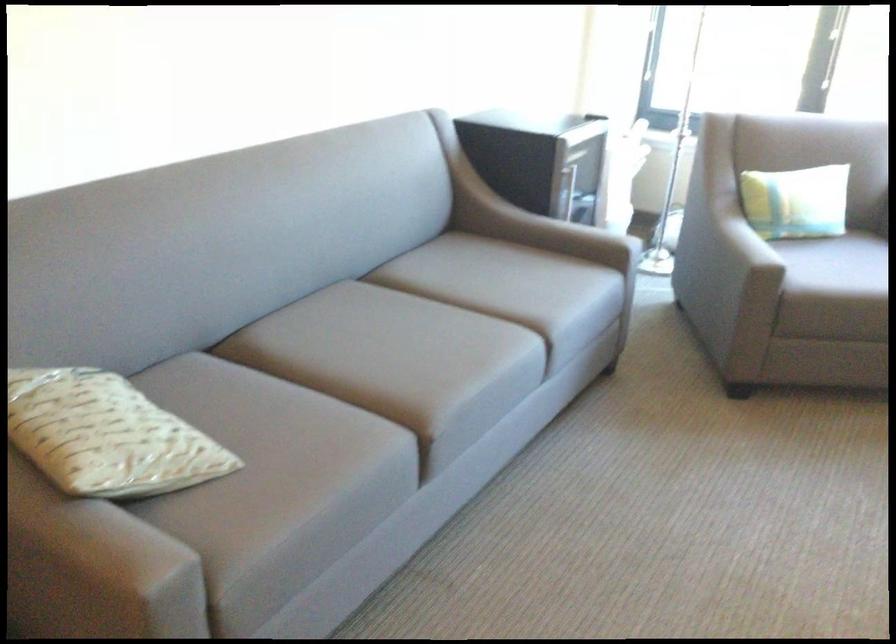
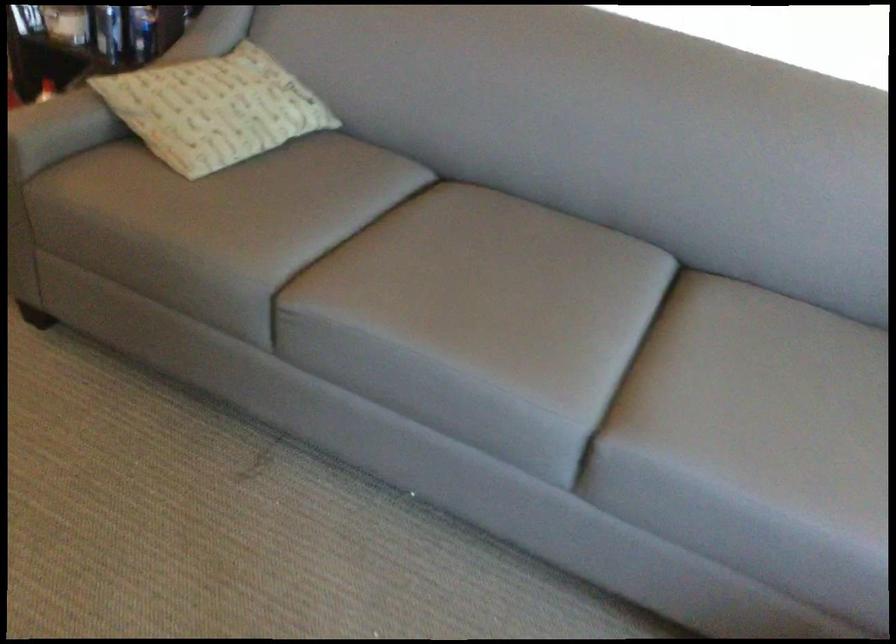
Locate, in the second image, the point that corresponds to point (124, 567) in the first image.

(32, 125)